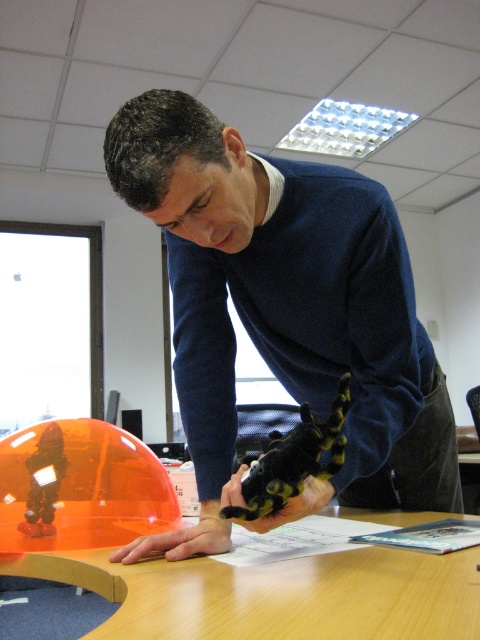
Between smooth skin hand at center and black fuzzy glove at lower center, which one has more height?

black fuzzy glove at lower center is taller.

Who is higher up, smooth skin hand at center or black fuzzy glove at lower center?

black fuzzy glove at lower center

Is point (120, 552) positioned in front of point (274, 515)?

No, (120, 552) is further to viewer.

Image resolution: width=480 pixels, height=640 pixels. Identify the location of smooth skin hand at center. (180, 540).

Between black fuzzy toy at center and black fuzzy glove at lower center, which one appears on the left side from the viewer's perspective?

Positioned to the left is black fuzzy glove at lower center.

Does point (272, 486) come farther from viewer compared to point (295, 502)?

No.

Does point (294, 465) come closer to viewer compared to point (324, 490)?

That is True.

At what (x,y) coordinates should I click in order to perform the action: click on black fuzzy toy at center. Please return your answer as a coordinate pair (x, y). This screenshot has width=480, height=640. Looking at the image, I should click on (292, 460).

Does blue matte sweater at center appear under black fuzzy toy at center?

No, blue matte sweater at center is not below black fuzzy toy at center.

Is blue matte sweater at center wider than black fuzzy toy at center?

Indeed, blue matte sweater at center has a greater width compared to black fuzzy toy at center.

At what (x,y) coordinates should I click in order to perform the action: click on blue matte sweater at center. Please return your answer as a coordinate pair (x, y). This screenshot has width=480, height=640. Looking at the image, I should click on (288, 298).

In order to click on blue matte sweater at center in this screenshot , I will do `click(288, 298)`.